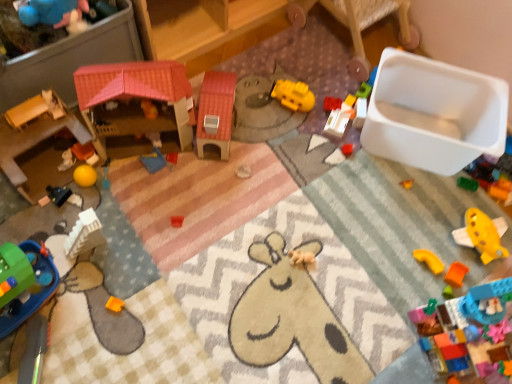
In order to click on free spot behind yellow plastic block at upper center, the fifth toy from the right in this screenshot , I will do `click(335, 74)`.